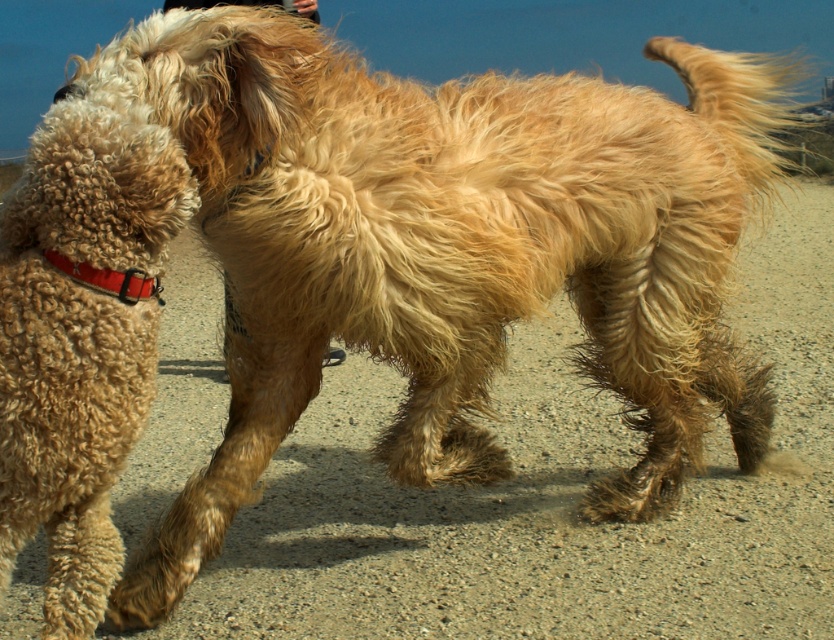
Is the position of curly golden fur at left more distant than that of red fabric collar at left?

No, it is in front of red fabric collar at left.

Describe the element at coordinates (79, 339) in the screenshot. I see `curly golden fur at left` at that location.

This screenshot has height=640, width=834. Identify the location of curly golden fur at left. (79, 339).